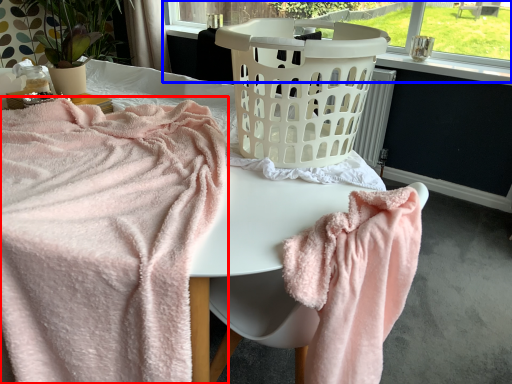
Question: Which of the following is the closest to the observer, towel (highlighted by a red box) or bay window (highlighted by a blue box)?

Choices:
 (A) towel
 (B) bay window

Answer: (A)